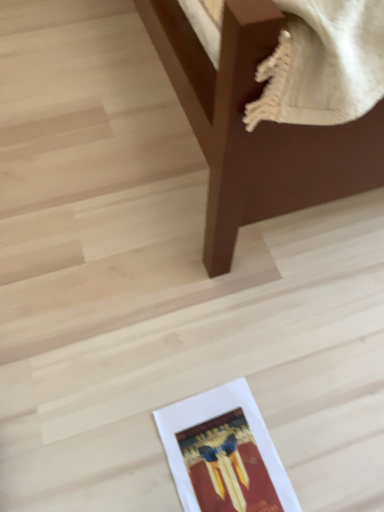
Identify the location of vacant space to the left of matte paper paperback book at lower center. This screenshot has width=384, height=512. (112, 442).